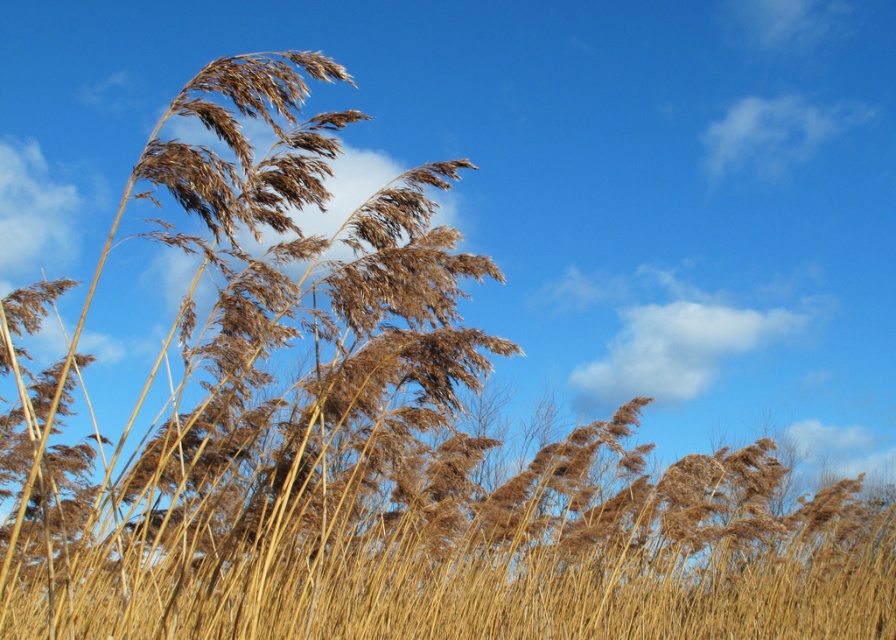
Is the position of white fluffy cloud at upper center more distant than that of white fluffy cloud at upper right?

No, white fluffy cloud at upper center is closer to the viewer.

Does white fluffy cloud at upper center have a smaller size compared to white fluffy cloud at upper right?

Yes.

Find the location of a particular element. white fluffy cloud at upper center is located at coordinates (676, 348).

Identify the location of white fluffy cloud at upper center. This screenshot has height=640, width=896. (676, 348).